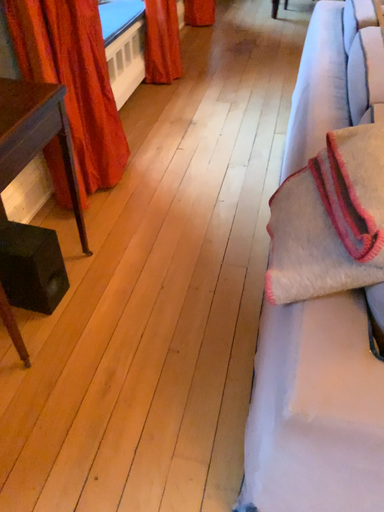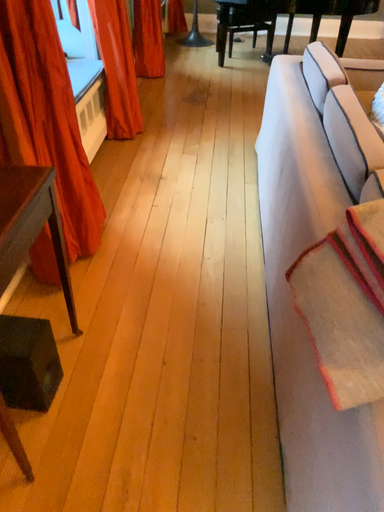
Question: Which way did the camera rotate in the video?

Choices:
 (A) rotated right
 (B) rotated left

Answer: (A)